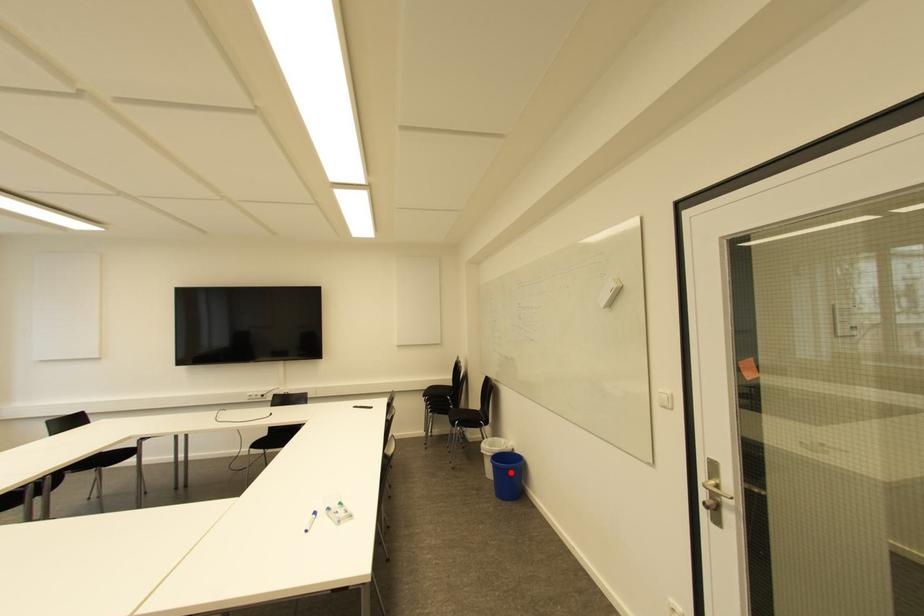
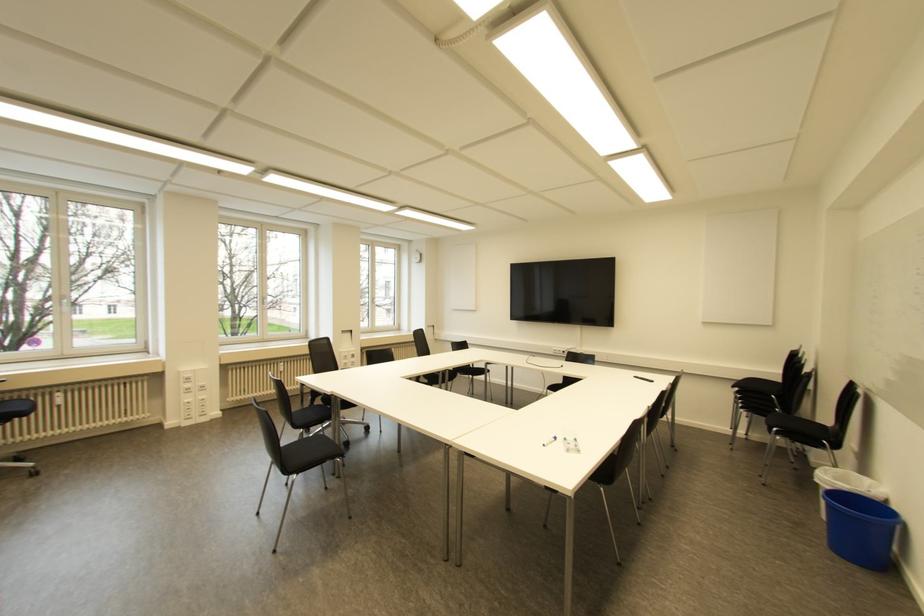
Question: A red point is marked in image1. In image2, is the corresponding 3D point closer to the camera or farther? Reply with the corresponding letter.

Choices:
 (A) The corresponding 3D point is closer.
 (B) The corresponding 3D point is farther.

Answer: (B)